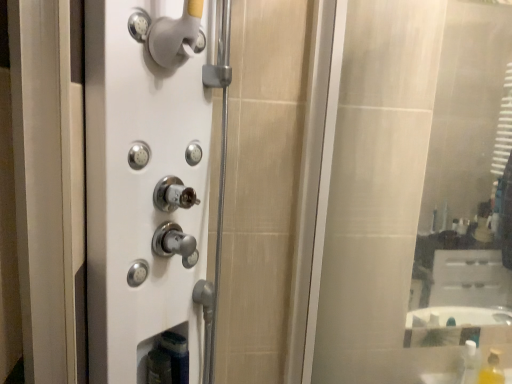
Locate an element on the screen. This screenshot has width=512, height=384. transparent glass screen door at center is located at coordinates (269, 186).

Describe the element at coordinates (269, 186) in the screenshot. This screenshot has width=512, height=384. I see `transparent glass screen door at center` at that location.

Find the location of a particular element. The image size is (512, 384). transparent glass screen door at center is located at coordinates (269, 186).